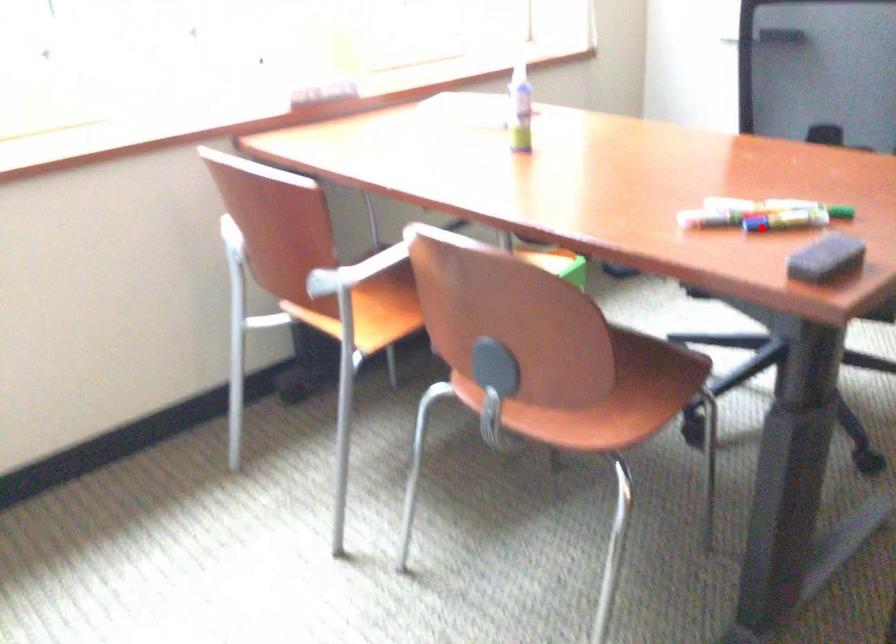
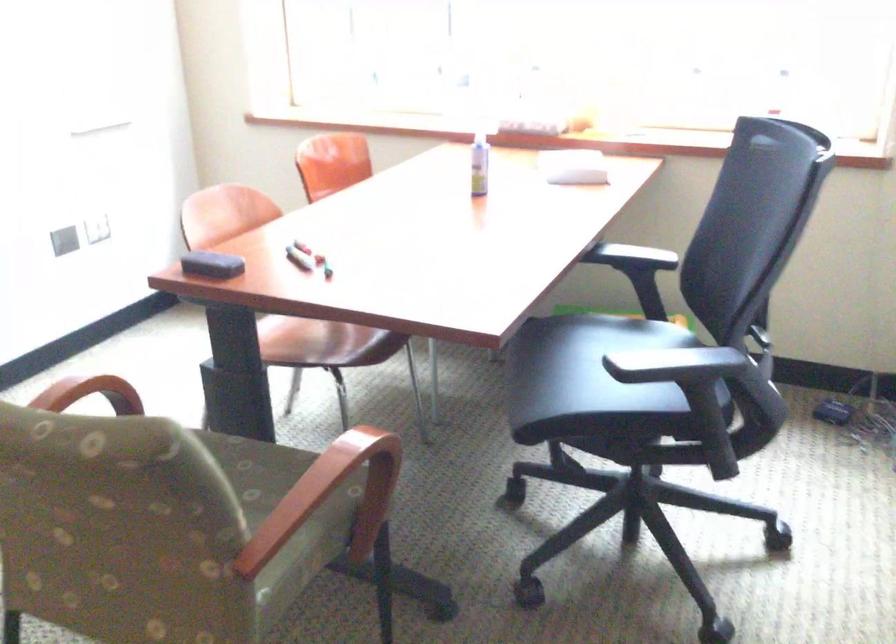
Question: I am providing you with two images of the same scene from different viewpoints. A red point is shown in image1. For the corresponding object point in image2, is it positioned nearer or farther from the camera?

Choices:
 (A) Nearer
 (B) Farther

Answer: (B)